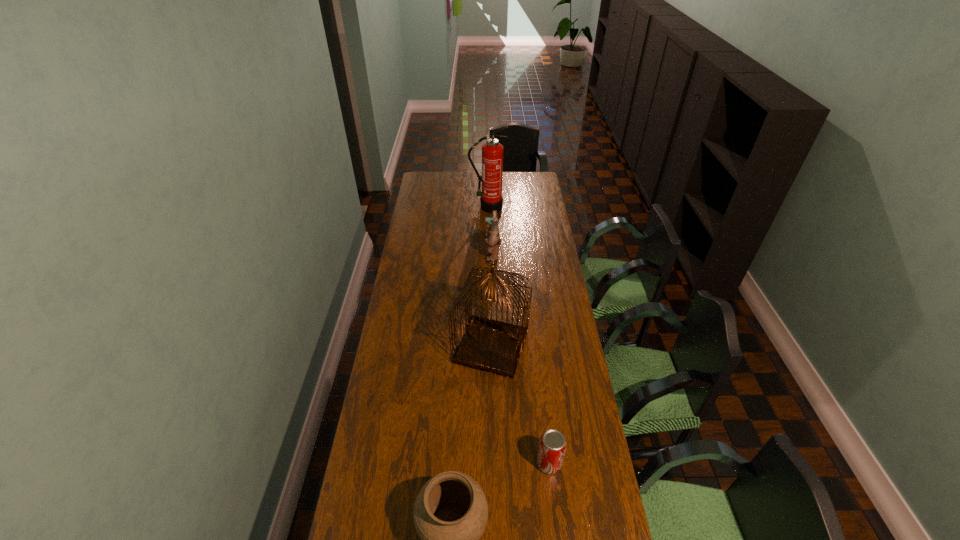
Locate an element on the screen. The image size is (960, 540). free spot located on the front-facing side of the figurine is located at coordinates (432, 256).

Locate an element on the screen. free space located on the back of the shortest object is located at coordinates (537, 357).

In order to click on object situated at the right edge in this screenshot , I will do `click(552, 446)`.

Image resolution: width=960 pixels, height=540 pixels. Identify the location of free region at the far edge. (473, 185).

Locate an element on the screen. vacant space at the left edge is located at coordinates (427, 198).

In the image, there is a desktop. At what (x,y) coordinates should I click in order to perform the action: click on vacant space at the right edge. Please return your answer as a coordinate pair (x, y). This screenshot has width=960, height=540. Looking at the image, I should click on (568, 313).

What are the coordinates of `vacant region between the third tallest object and the fourth farthest object` in the screenshot? It's located at (520, 360).

Find the location of a particular element. This screenshot has height=540, width=960. free space between the third tallest object and the shortest object is located at coordinates 520,360.

The image size is (960, 540). Identify the location of object that is the fourth closest to the second nearest object. coord(491,199).

Identify which object is the fourth closest to the nearest object. Please provide its 2D coordinates. Your answer should be formatted as a tuple, i.e. [(x, y)], where the tuple contains the x and y coordinates of a point satisfying the conditions above.

[(491, 199)]